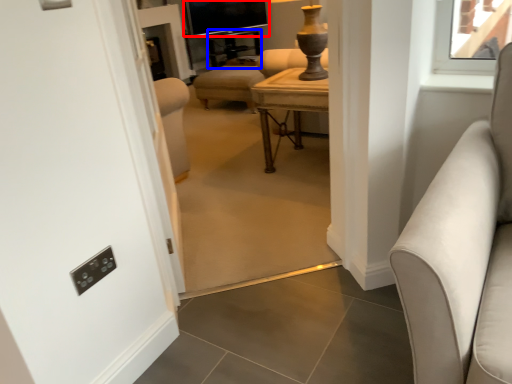
Question: Which object is closer to the camera taking this photo, window screen (highlighted by a red box) or side table (highlighted by a blue box)?

Choices:
 (A) window screen
 (B) side table

Answer: (B)